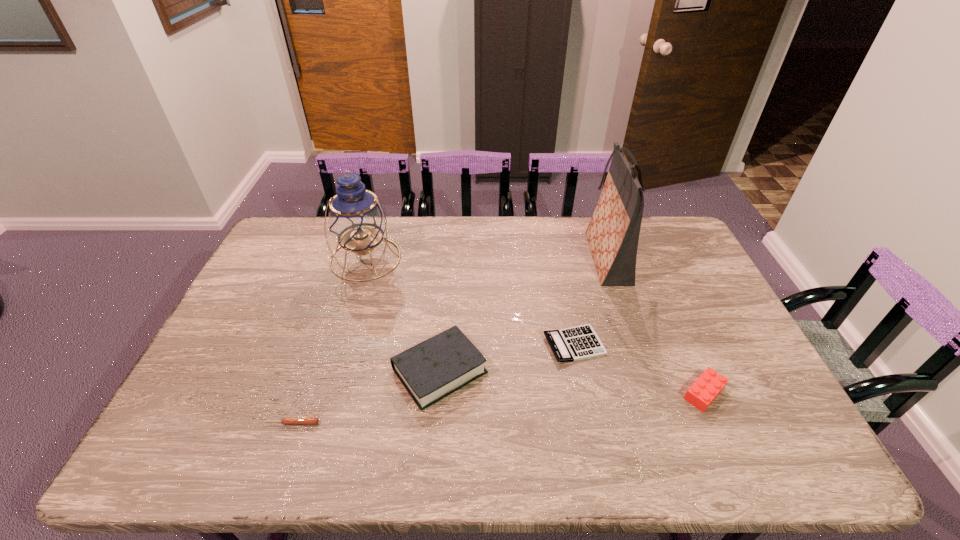
Where is `free space between the lantern and the fourth tallest object`? free space between the lantern and the fourth tallest object is located at coordinates (535, 326).

You are a GUI agent. You are given a task and a screenshot of the screen. Output one action in this format:
    pyautogui.click(x=<x>, y=<y>)
    Task: Click on the vacant area that lies between the nearest object and the fifth shortest object
    This screenshot has height=540, width=960.
    Given the screenshot: What is the action you would take?
    pyautogui.click(x=329, y=341)

Select which object is the closest to the lantern. Please provide its 2D coordinates. Your answer should be formatted as a tuple, i.e. [(x, y)], where the tuple contains the x and y coordinates of a point satisfying the conditions above.

[(435, 368)]

Locate which object is the second closest to the lantern. Please provide its 2D coordinates. Your answer should be formatted as a tuple, i.e. [(x, y)], where the tuple contains the x and y coordinates of a point satisfying the conditions above.

[(576, 343)]

What are the coordinates of `blank space that satisfies the following two spatial constraints: 1. on the front-facing side of the lantern; 2. on the left side of the third object from right to left` in the screenshot? It's located at (340, 345).

You are a GUI agent. You are given a task and a screenshot of the screen. Output one action in this format:
    pyautogui.click(x=<x>, y=<y>)
    Task: Click on the vacant space that satisfies the following two spatial constraints: 1. on the front-facing side of the shopping bag; 2. on the right side of the Lego
    This screenshot has width=960, height=540.
    Given the screenshot: What is the action you would take?
    pyautogui.click(x=651, y=393)

Where is `free spot that satisfies the following two spatial constraints: 1. on the front-facing side of the shopping bag; 2. on the back side of the third shortest object`? The height and width of the screenshot is (540, 960). free spot that satisfies the following two spatial constraints: 1. on the front-facing side of the shopping bag; 2. on the back side of the third shortest object is located at coordinates (651, 393).

At what (x,y) coordinates should I click in order to perform the action: click on free point that satisfies the following two spatial constraints: 1. on the front-facing side of the shopping bag; 2. on the front side of the Bible. Please return your answer as a coordinate pair (x, y). Looking at the image, I should click on (644, 371).

This screenshot has height=540, width=960. What are the coordinates of `free space that satisfies the following two spatial constraints: 1. on the front-facing side of the shopping bag; 2. on the back side of the fourth tallest object` in the screenshot? It's located at (651, 393).

Locate an element on the screen. vacant space that satisfies the following two spatial constraints: 1. on the front-facing side of the lantern; 2. on the left side of the third object from right to left is located at coordinates click(340, 345).